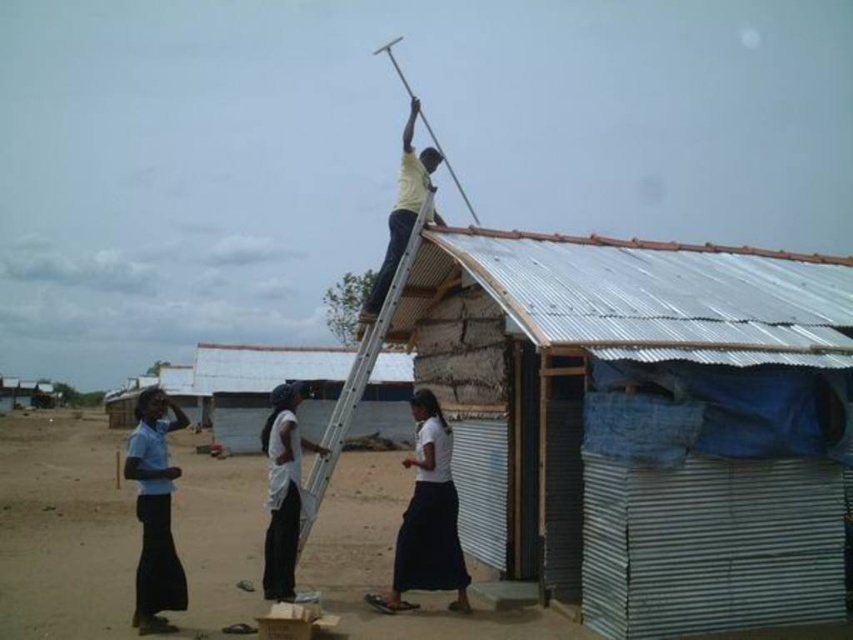
Question: Which of the following is the closest to the observer?

Choices:
 (A) metal corrugated hut at upper right
 (B) white matte shirt at center

Answer: (A)

Question: Can you confirm if metal corrugated hut at upper right is positioned below white corrugated metal roof at upper center?

Choices:
 (A) yes
 (B) no

Answer: (B)

Question: Does metallic corrugated roof at upper center have a greater width compared to yellow matte shirt at upper center?

Choices:
 (A) no
 (B) yes

Answer: (A)

Question: Which object is farther from the camera taking this photo?

Choices:
 (A) yellow matte shirt at upper center
 (B) blue fabric skirt at lower left
 (C) metallic corrugated roof at upper center

Answer: (A)

Question: Is metallic silver ladder at upper center below white matte shirt at center?

Choices:
 (A) yes
 (B) no

Answer: (B)

Question: Among these objects, which one is farthest from the camera?

Choices:
 (A) white matte skirt at lower center
 (B) metal corrugated hut at upper right
 (C) white corrugated metal roof at upper center
 (D) yellow matte shirt at upper center

Answer: (D)